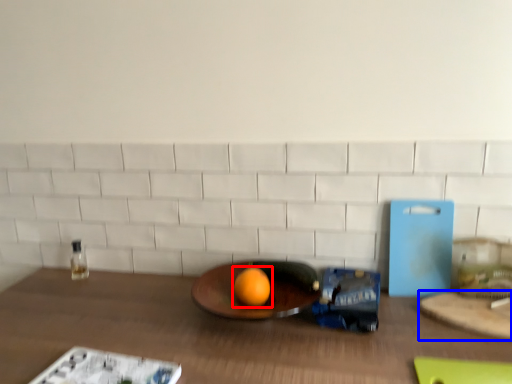
Question: Which object is further to the camera taking this photo, grapefruit (highlighted by a red box) or cutting board (highlighted by a blue box)?

Choices:
 (A) grapefruit
 (B) cutting board

Answer: (A)